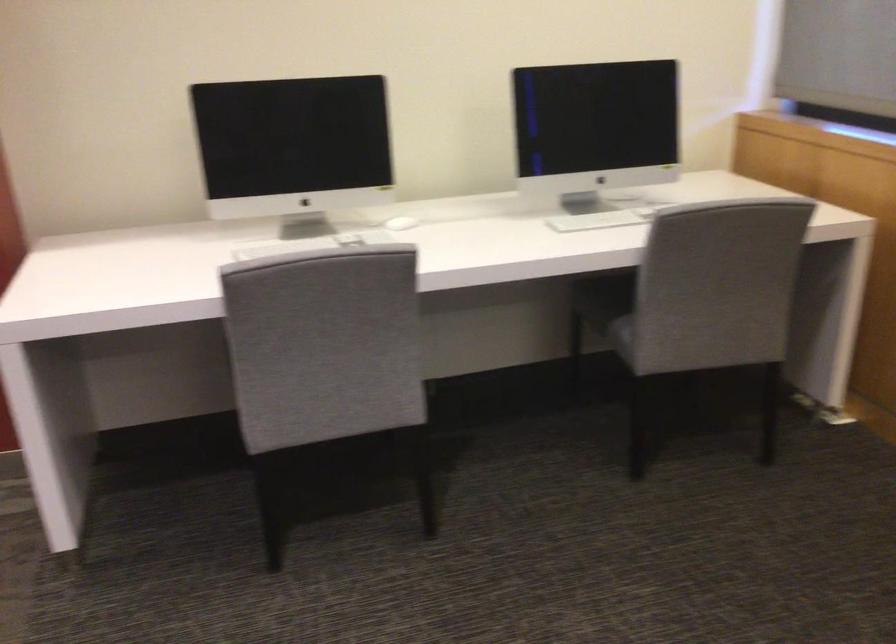
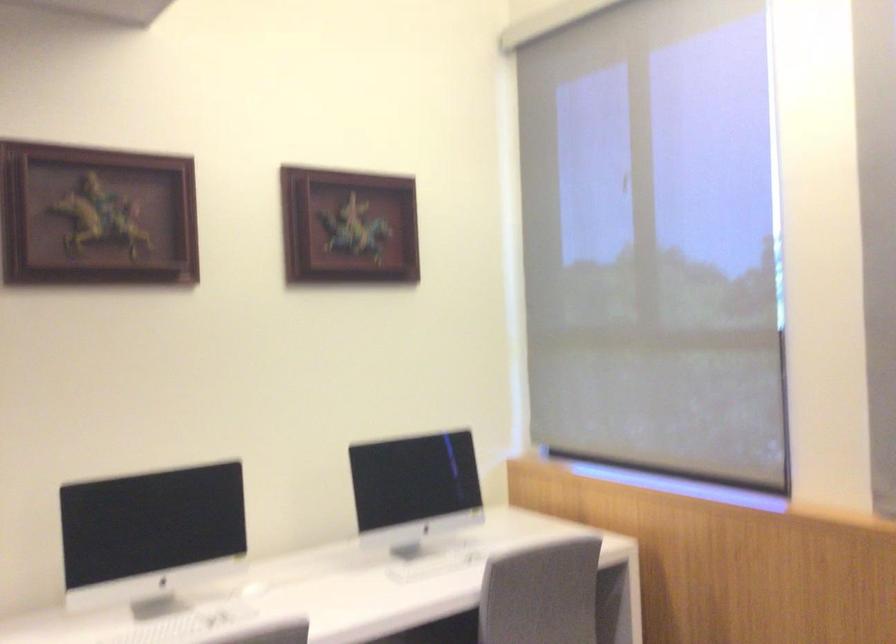
The images are taken continuously from a first-person perspective. In which direction is your viewpoint rotating?

The rotation direction of the camera is right-up.